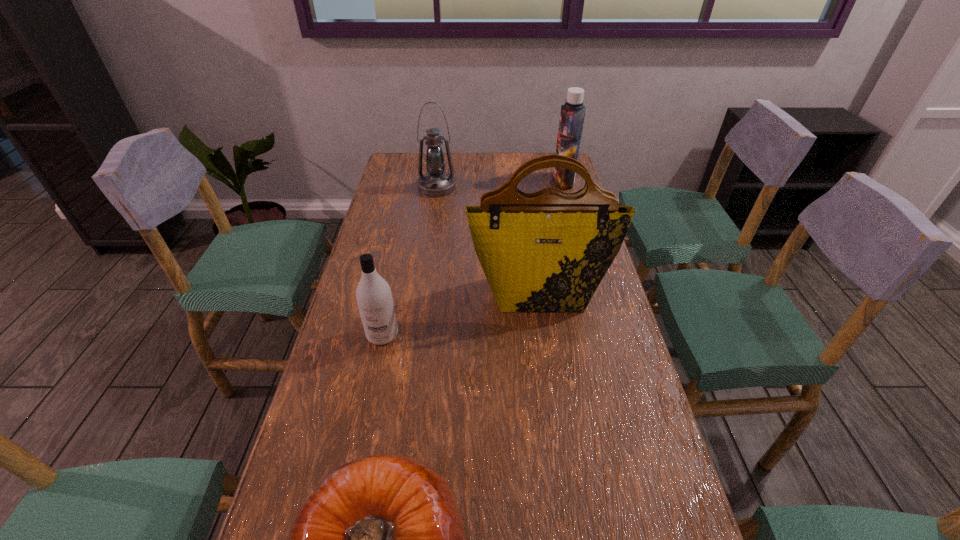
Where is `blank area located 0.380m on the front label of the right shampoo`? This screenshot has height=540, width=960. blank area located 0.380m on the front label of the right shampoo is located at coordinates (454, 181).

At what (x,y) coordinates should I click in order to perform the action: click on vacant area situated 0.130m on the back of the oil lamp. Please return your answer as a coordinate pair (x, y). Looking at the image, I should click on (441, 161).

You are a GUI agent. You are given a task and a screenshot of the screen. Output one action in this format:
    pyautogui.click(x=<x>, y=<y>)
    Task: Click on the vacant area situated on the front-facing side of the nearer shampoo
    This screenshot has height=540, width=960.
    Given the screenshot: What is the action you would take?
    pyautogui.click(x=372, y=384)

This screenshot has height=540, width=960. I want to click on shampoo that is at the far edge, so click(572, 114).

I want to click on oil lamp that is positioned at the far edge, so click(436, 183).

Locate an element on the screen. oil lamp that is at the left edge is located at coordinates pos(436,183).

Locate an element on the screen. The image size is (960, 540). shampoo present at the left edge is located at coordinates (374, 298).

Locate an element on the screen. tote bag present at the right edge is located at coordinates (547, 251).

Locate an element on the screen. shampoo that is at the right edge is located at coordinates [572, 114].

At what (x,y) coordinates should I click in order to perform the action: click on object situated at the far left corner. Please return your answer as a coordinate pair (x, y). This screenshot has height=540, width=960. Looking at the image, I should click on (436, 183).